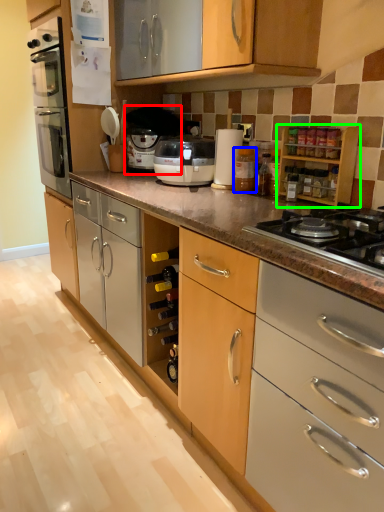
Question: Based on their relative distances, which object is nearer to coffee machine (highlighted by a red box)? Choose from bottle (highlighted by a blue box) and cabinetry (highlighted by a green box).

Choices:
 (A) bottle
 (B) cabinetry

Answer: (A)